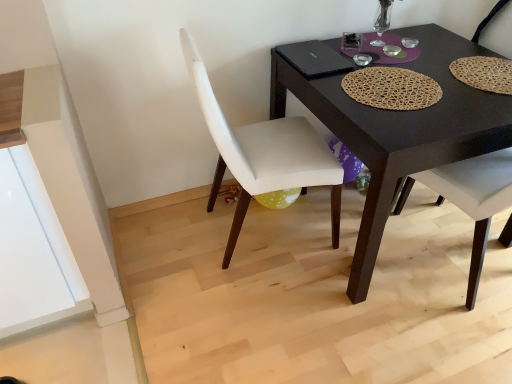
Find the location of a particular element. This screenshot has height=384, width=512. vacant space in front of white leather chair at center, which is the 1th chair from left to right is located at coordinates (266, 311).